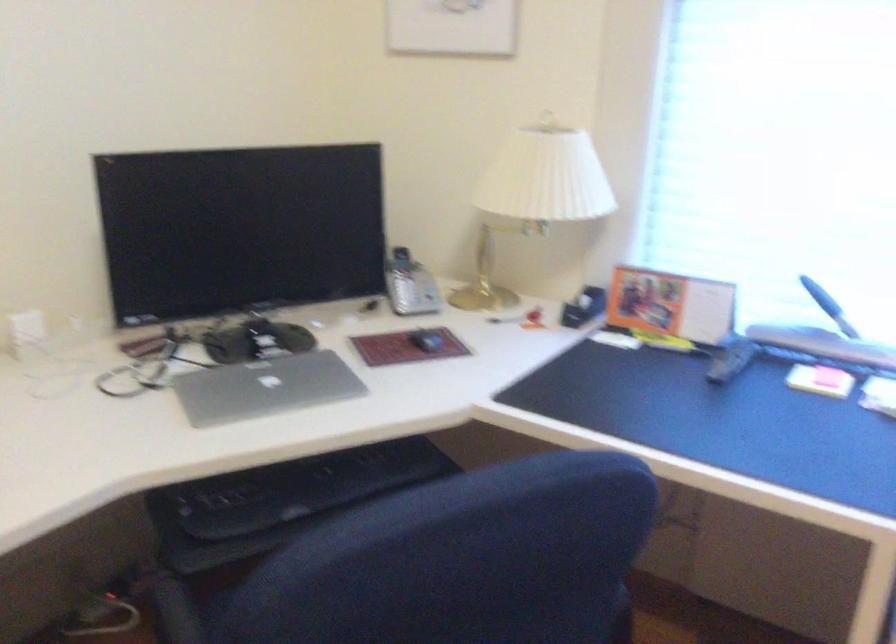
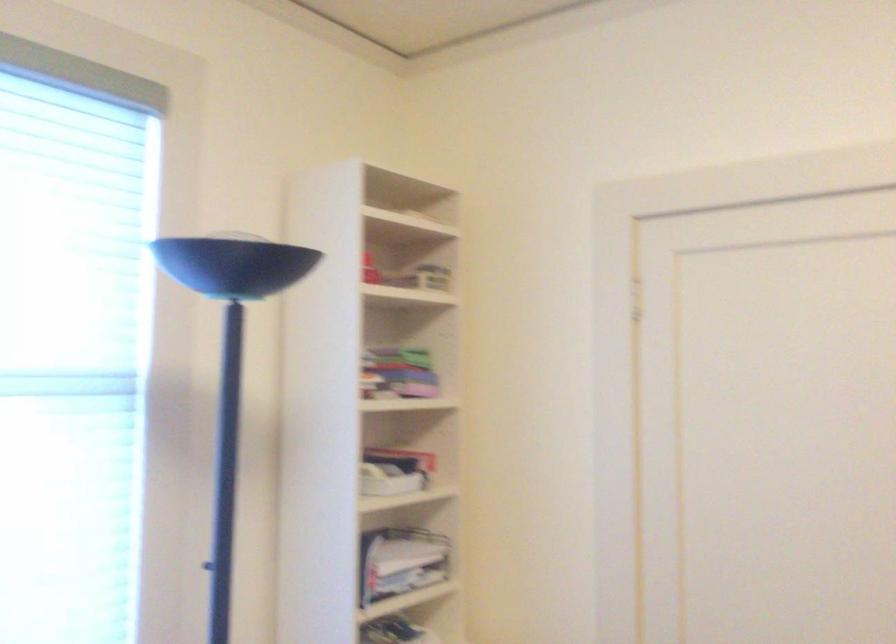
Question: How did the camera likely rotate?

Choices:
 (A) Left
 (B) Right
 (C) Up
 (D) Down

Answer: (B)